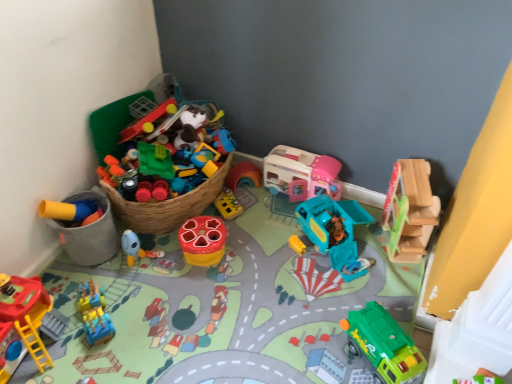
This screenshot has width=512, height=384. In order to click on free space in front of blue rubber duck at center, which ranks as the sixth toy in right-to-left order in this screenshot , I will do `click(143, 292)`.